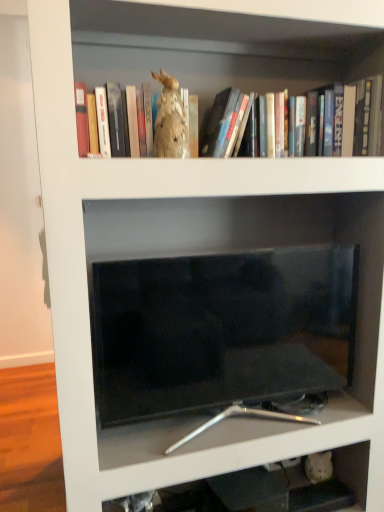
Question: Does matte gold statue at upper center have a greater width compared to beige fabric rabbit at upper center?

Choices:
 (A) yes
 (B) no

Answer: (A)

Question: Can you confirm if matte gold statue at upper center is taller than beige fabric rabbit at upper center?

Choices:
 (A) no
 (B) yes

Answer: (A)

Question: Is matte gold statue at upper center next to beige fabric rabbit at upper center and touching it?

Choices:
 (A) no
 (B) yes

Answer: (A)

Question: From a real-world perspective, is matte gold statue at upper center located higher than beige fabric rabbit at upper center?

Choices:
 (A) yes
 (B) no

Answer: (A)

Question: Is matte gold statue at upper center smaller than beige fabric rabbit at upper center?

Choices:
 (A) yes
 (B) no

Answer: (B)

Question: Is matte gold statue at upper center to the left or to the right of beige fabric rabbit at upper center in the image?

Choices:
 (A) right
 (B) left

Answer: (A)

Question: Does point (77, 76) appear closer or farther from the camera than point (162, 124)?

Choices:
 (A) closer
 (B) farther

Answer: (B)

Question: Choose the correct answer: Is matte gold statue at upper center inside beige fabric rabbit at upper center or outside it?

Choices:
 (A) outside
 (B) inside

Answer: (A)

Question: From the image's perspective, is matte gold statue at upper center above or below beige fabric rabbit at upper center?

Choices:
 (A) above
 (B) below

Answer: (A)

Question: Is black glossy tv at center inside or outside of matte gold statue at upper center?

Choices:
 (A) inside
 (B) outside

Answer: (B)

Question: From their relative heights in the image, would you say black glossy tv at center is taller or shorter than matte gold statue at upper center?

Choices:
 (A) short
 (B) tall

Answer: (B)

Question: From a real-world perspective, is black glossy tv at center positioned above or below matte gold statue at upper center?

Choices:
 (A) below
 (B) above

Answer: (A)

Question: Would you say black glossy tv at center is to the left or to the right of matte gold statue at upper center in the picture?

Choices:
 (A) left
 (B) right

Answer: (B)

Question: Does point (165, 90) appear closer or farther from the camera than point (311, 237)?

Choices:
 (A) farther
 (B) closer

Answer: (B)

Question: From their relative heights in the image, would you say beige fabric rabbit at upper center is taller or shorter than black glossy tv at center?

Choices:
 (A) tall
 (B) short

Answer: (B)